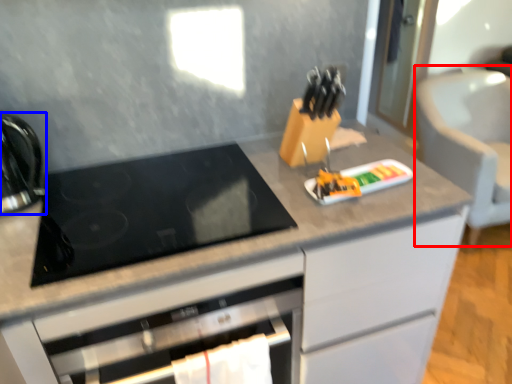
Question: Which of the following is the closest to the observer, armchair (highlighted by a red box) or kitchen appliance (highlighted by a blue box)?

Choices:
 (A) armchair
 (B) kitchen appliance

Answer: (B)